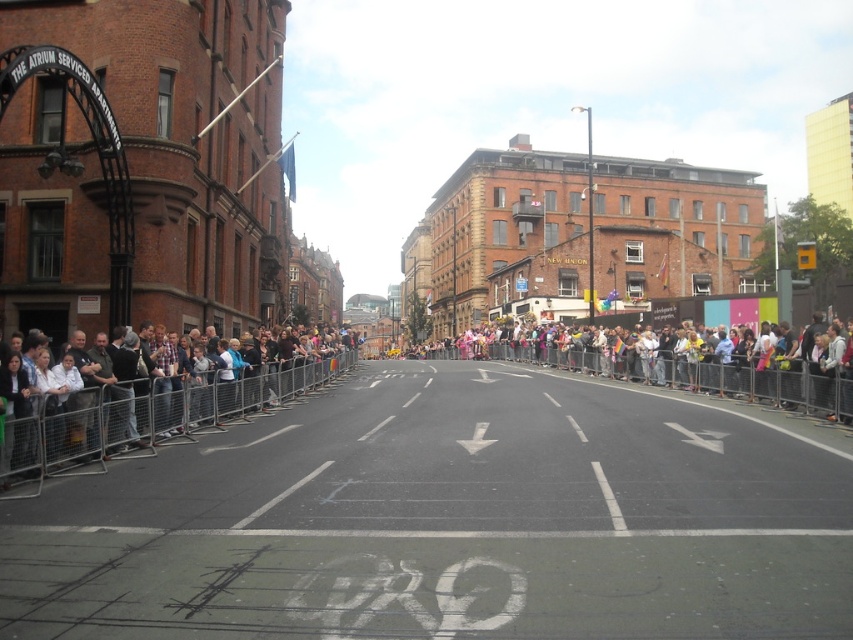
You are a photographer standing in the street and want to capture both the metal barricade at left and the multicolored fabric crowd at center in your shot. Which object should you focus on first to ensure both are in frame?

You should focus on the metal barricade at left first because it is closer to you, allowing the multicolored fabric crowd at center to stay in the background of the frame.

You are a street performer planning to set up a booth between the metal barricade at left and the multicolored fabric crowd at center. Considering their sizes, which object should you place your booth closer to for better visibility?

The metal barricade at left has a smaller size compared to the multicolored fabric crowd at center, so placing the booth closer to the metal barricade at left would provide better visibility as it takes up less space.